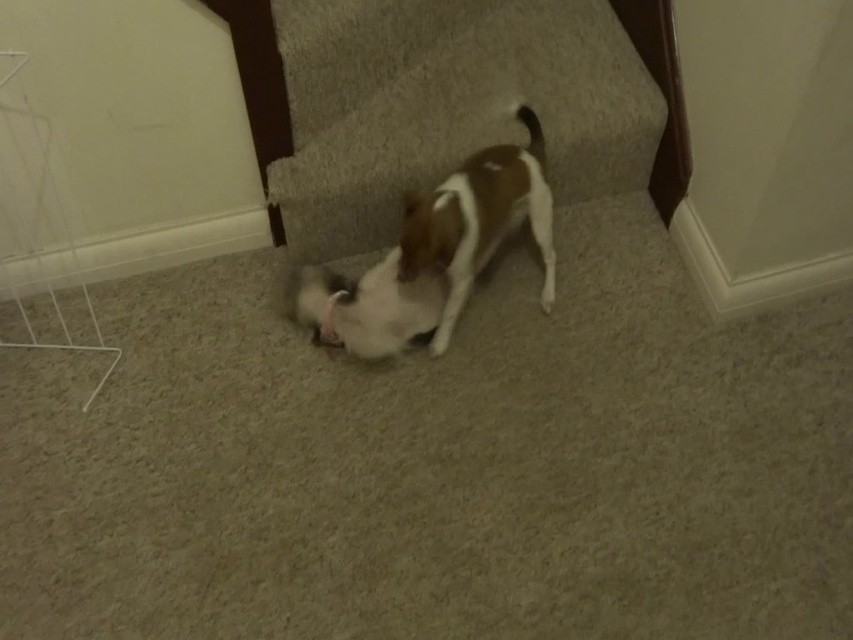
You are a dog owner trying to guide your dog away from the staircase. You see the white fur dog at center and the carpeted stair at lower center. Which direction should you move your dog to get it away from the staircase?

The carpeted stair at lower center is to the right of white fur dog at center. To move the dog away from the staircase, you should guide the white fur dog at center to the left side of the frame.

You are a drone flying above the scene and need to locate the carpeted stair at lower center. What are its coordinates in the image?

The carpeted stair at lower center is located at coordinates point [448,104].